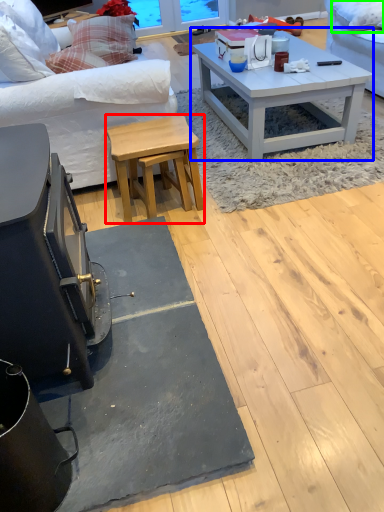
Question: Based on their relative distances, which object is nearer to stool (highlighted by a red box)? Choose from coffee table (highlighted by a blue box) and pillow (highlighted by a green box).

Choices:
 (A) coffee table
 (B) pillow

Answer: (A)